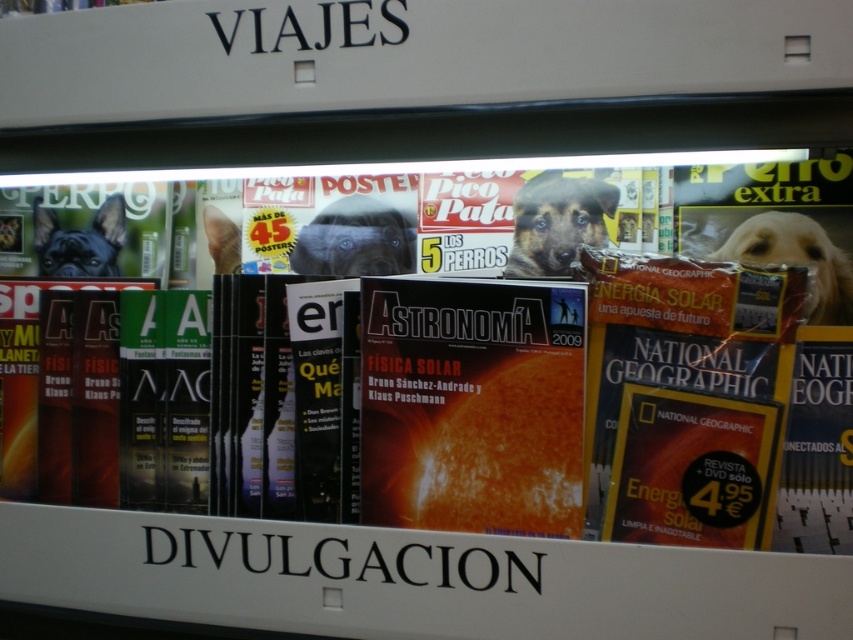
Is orange matte magazine at center below matte black dog at center?

Yes.

Is point (434, 422) closer to camera compared to point (305, 244)?

Yes, point (434, 422) is closer to viewer.

Which is in front, point (851, 465) or point (328, 256)?

Point (851, 465) is more forward.

This screenshot has height=640, width=853. Identify the location of orange matte magazine at center. (579, 396).

Does brown fur dog at center have a lesser width compared to light brown fur at center?

Incorrect, brown fur dog at center's width is not less than light brown fur at center's.

Looking at this image, which of these two, brown fur dog at center or light brown fur at center, stands taller?

brown fur dog at center is taller.

This screenshot has height=640, width=853. Find the location of `brown fur dog at center`. brown fur dog at center is located at coordinates (556, 221).

Is orange matte magazine at center further to camera compared to light brown fur at center?

No, it is not.

Between point (778, 392) and point (219, 220), which one is positioned behind?

Positioned behind is point (219, 220).

Where is `orange matte magazine at center`? orange matte magazine at center is located at coordinates (579, 396).

This screenshot has width=853, height=640. Identify the location of orange matte magazine at center. (579, 396).